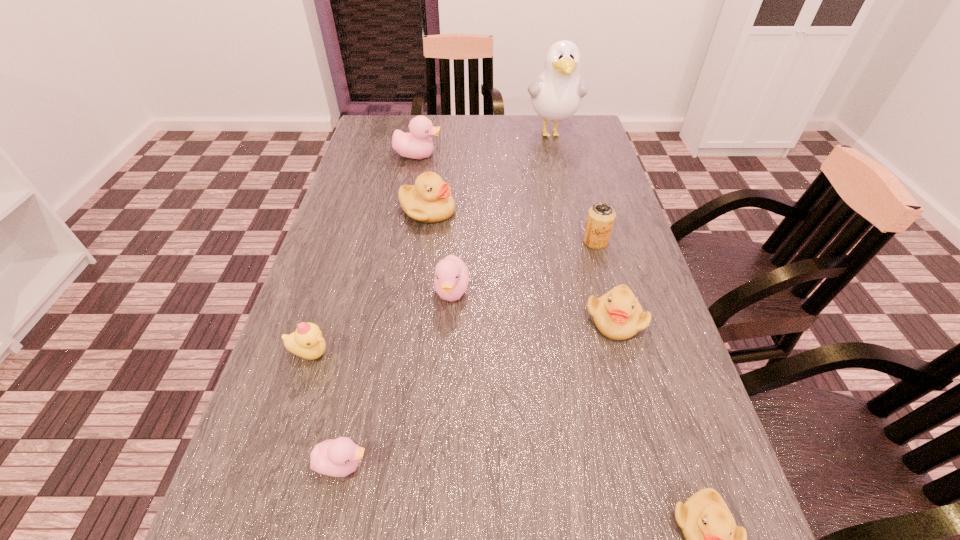
Find the location of `gull positioned at the far edge`. gull positioned at the far edge is located at coordinates (556, 95).

Find the location of a particular element. Image resolution: width=960 pixels, height=540 pixels. duckling that is positioned at the far edge is located at coordinates (417, 144).

I want to click on gull that is positioned at the right edge, so tap(556, 95).

Where is `beer can located at the right edge`? beer can located at the right edge is located at coordinates (601, 216).

The image size is (960, 540). I want to click on duckling at the right edge, so click(x=618, y=315).

The width and height of the screenshot is (960, 540). In order to click on object positioned at the far left corner in this screenshot , I will do `click(417, 144)`.

I want to click on object located in the far right corner section of the desktop, so click(x=556, y=95).

You are a GUI agent. You are given a task and a screenshot of the screen. Output one action in this format:
    pyautogui.click(x=<x>, y=<y>)
    Task: Click on the free space at the far edge
    The image size is (960, 540).
    Given the screenshot: What is the action you would take?
    pyautogui.click(x=490, y=120)

You are a GUI agent. You are given a task and a screenshot of the screen. Output one action in this format:
    pyautogui.click(x=<x>, y=<y>)
    Task: Click on the vacant space at the left edge
    This screenshot has height=540, width=960.
    Given the screenshot: What is the action you would take?
    pyautogui.click(x=367, y=227)

At what (x,y) coordinates should I click in order to perform the action: click on free space at the right edge. Please return your answer as a coordinate pair (x, y). Looking at the image, I should click on (556, 162).